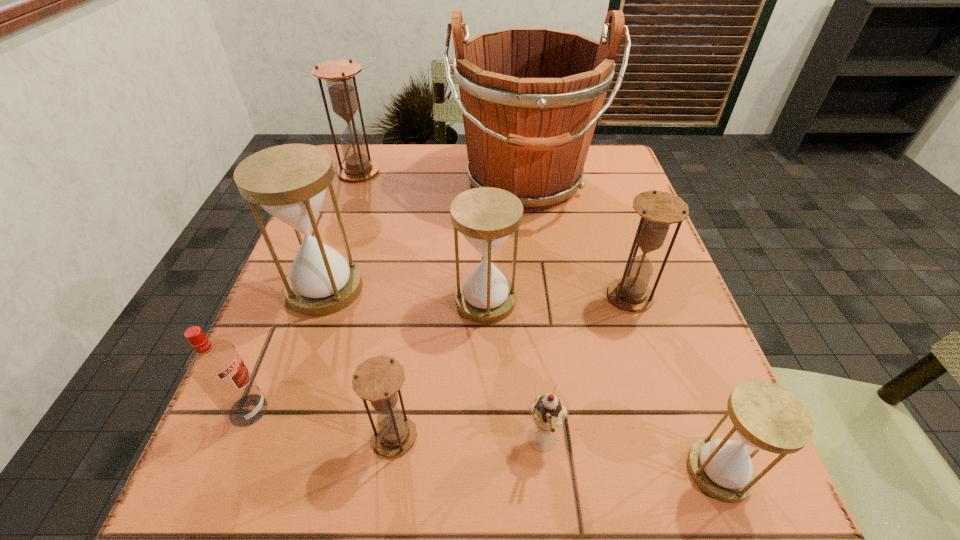
Locate an element on the screen. white hourglass that stands as the second closest to the tallest object is located at coordinates [289, 182].

Image resolution: width=960 pixels, height=540 pixels. I want to click on the second closest white hourglass to the icecream, so click(x=486, y=216).

Where is `vacant space that satisfies the following two spatial constraints: 1. on the front label of the vodka; 2. on the left side of the rightmost white hourglass`? The image size is (960, 540). vacant space that satisfies the following two spatial constraints: 1. on the front label of the vodka; 2. on the left side of the rightmost white hourglass is located at coordinates (224, 470).